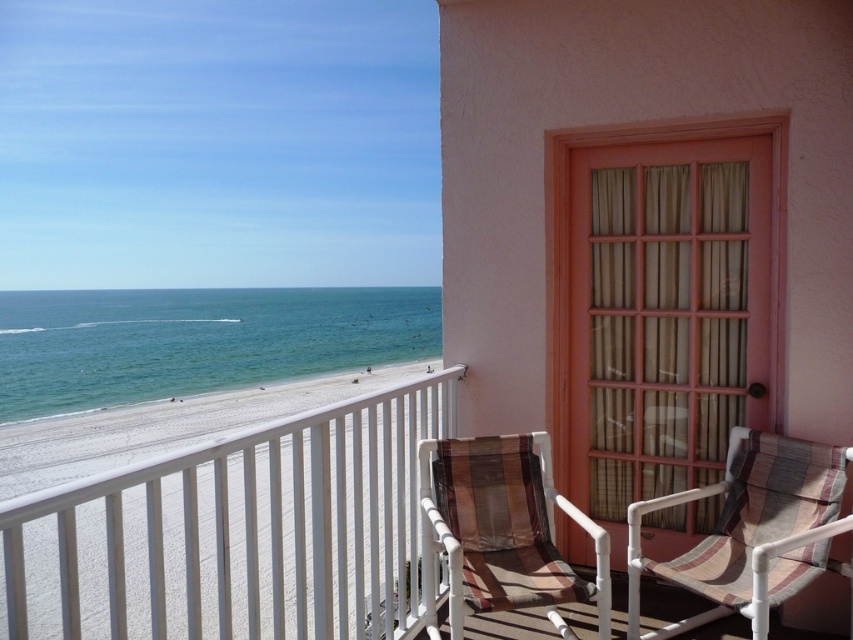
Which of these two, white plastic balustrade at lower left or brown striped fabric beach chair at center, stands shorter?

brown striped fabric beach chair at center is shorter.

Between white plastic balustrade at lower left and brown striped fabric beach chair at center, which one is positioned lower?

white plastic balustrade at lower left

Who is more distant from viewer, (270, 600) or (439, 524)?

The point (270, 600) is behind.

I want to click on white plastic balustrade at lower left, so click(x=231, y=529).

Is white plastic balustrade at lower left to the right of striped fabric beach chair at lower right from the viewer's perspective?

No, white plastic balustrade at lower left is not to the right of striped fabric beach chair at lower right.

How much distance is there between white plastic balustrade at lower left and striped fabric beach chair at lower right?

white plastic balustrade at lower left is 3.84 meters from striped fabric beach chair at lower right.

I want to click on white plastic balustrade at lower left, so coord(231,529).

Between white plastic balustrade at lower left and blue water at lower left, which one is positioned lower?

white plastic balustrade at lower left is below.

Between white plastic balustrade at lower left and blue water at lower left, which one has less height?

Standing shorter between the two is white plastic balustrade at lower left.

Where is `white plastic balustrade at lower left`? This screenshot has height=640, width=853. white plastic balustrade at lower left is located at coordinates (231, 529).